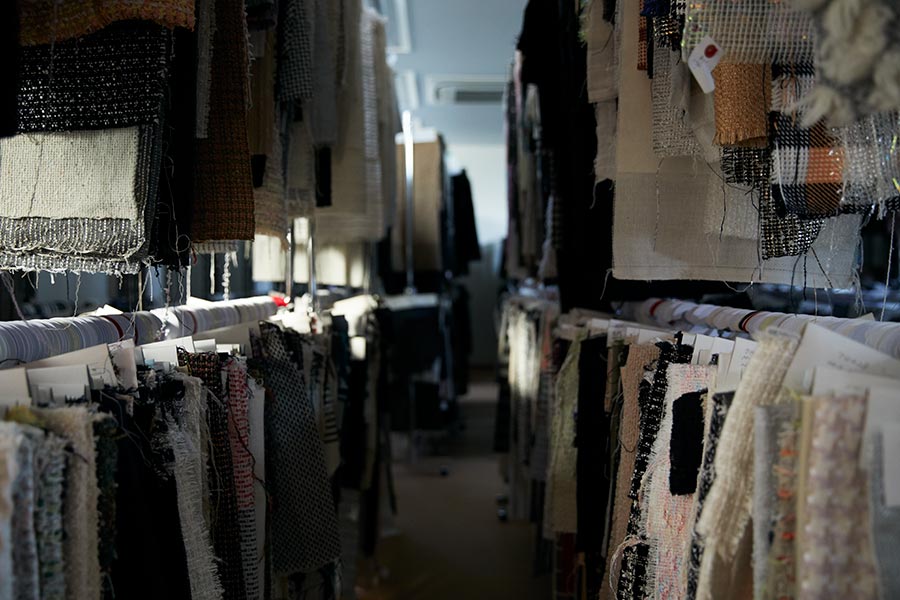
At what (x,y) coordinates should I click in order to perform the action: click on ceiling. Please return your answer as a coordinate pair (x, y). The width and height of the screenshot is (900, 600). Looking at the image, I should click on (490, 23), (428, 23), (445, 56), (483, 128).